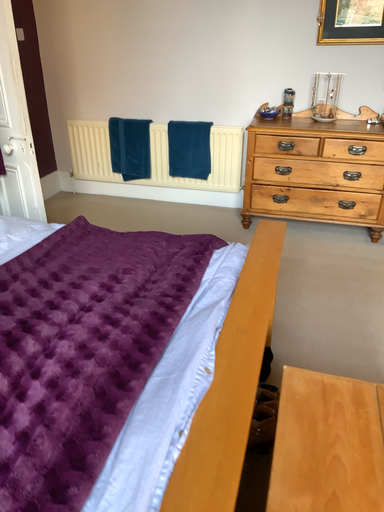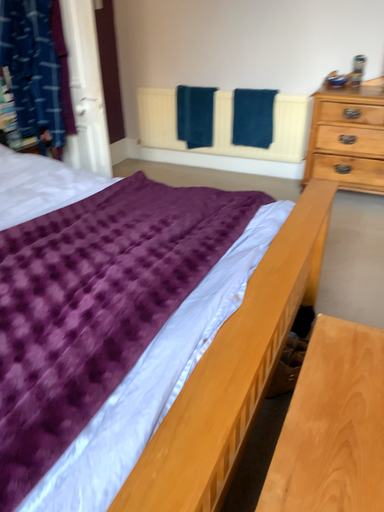
Question: Which way did the camera rotate in the video?

Choices:
 (A) rotated left
 (B) rotated right

Answer: (A)